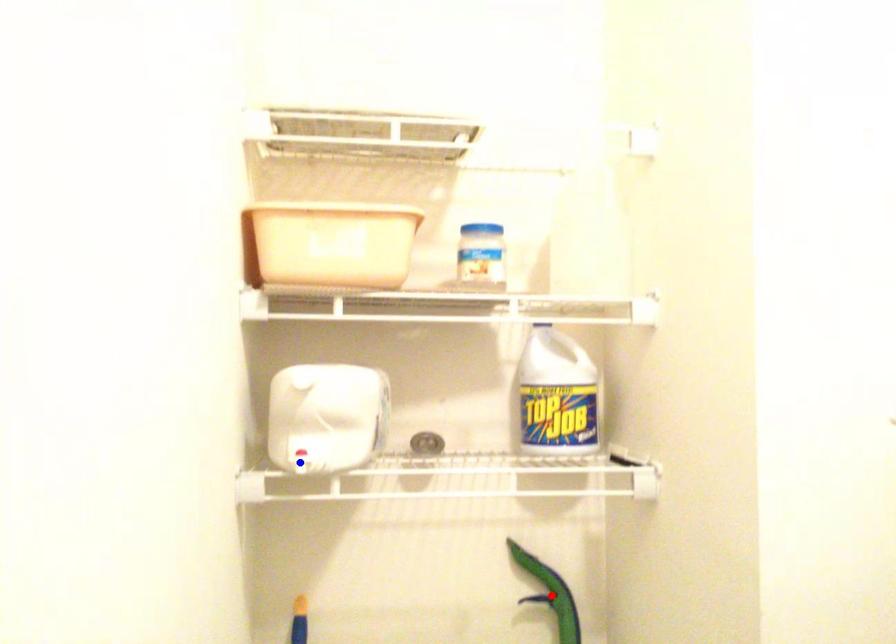
Question: Two points are marked on the image. Which point is closer to the camera?

Choices:
 (A) Blue point is closer.
 (B) Red point is closer.

Answer: (A)